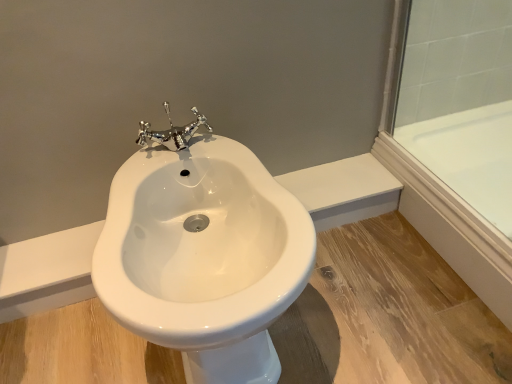
This screenshot has height=384, width=512. Describe the element at coordinates (455, 136) in the screenshot. I see `transparent glass door at upper right` at that location.

This screenshot has height=384, width=512. I want to click on transparent glass door at upper right, so click(x=455, y=136).

This screenshot has height=384, width=512. What do you see at coordinates (203, 253) in the screenshot?
I see `white glossy bidet at center` at bounding box center [203, 253].

Where is `white glossy bidet at center`? The height and width of the screenshot is (384, 512). white glossy bidet at center is located at coordinates (203, 253).

Locate an element on the screen. This screenshot has height=384, width=512. transparent glass door at upper right is located at coordinates (455, 136).

In the image, is white glossy bidet at center on the left side or the right side of transparent glass door at upper right?

white glossy bidet at center is to the left of transparent glass door at upper right.

Considering the positions of objects white glossy bidet at center and transparent glass door at upper right in the image provided, who is in front, white glossy bidet at center or transparent glass door at upper right?

white glossy bidet at center is more forward.

Considering the positions of points (212, 163) and (470, 189), is point (212, 163) farther from camera compared to point (470, 189)?

No, (212, 163) is closer to viewer.

From the image's perspective, is white glossy bidet at center located above or below transparent glass door at upper right?

Based on their image positions, white glossy bidet at center is located beneath transparent glass door at upper right.

From a real-world perspective, which object rests below the other?

transparent glass door at upper right is physically lower.

Considering the sizes of objects white glossy bidet at center and transparent glass door at upper right in the image provided, who is wider, white glossy bidet at center or transparent glass door at upper right?

white glossy bidet at center.

In the scene shown: Considering the sizes of objects white glossy bidet at center and transparent glass door at upper right in the image provided, who is taller, white glossy bidet at center or transparent glass door at upper right?

white glossy bidet at center is taller.

Considering the sizes of objects white glossy bidet at center and transparent glass door at upper right in the image provided, who is smaller, white glossy bidet at center or transparent glass door at upper right?

Smaller between the two is transparent glass door at upper right.

In the scene shown: Is white glossy bidet at center situated inside transparent glass door at upper right or outside?

white glossy bidet at center is not inside transparent glass door at upper right, it's outside.

Is white glossy bidet at center placed right next to transparent glass door at upper right?

No, white glossy bidet at center is not next to transparent glass door at upper right.

Is white glossy bidet at center facing away from transparent glass door at upper right?

white glossy bidet at center is not turned away from transparent glass door at upper right.

Locate an element on the screen. toilet located on the left of transparent glass door at upper right is located at coordinates (203, 253).

Is transparent glass door at upper right at the right side of white glossy bidet at center?

Correct, you'll find transparent glass door at upper right to the right of white glossy bidet at center.

Is transparent glass door at upper right in front of or behind white glossy bidet at center in the image?

Visually, transparent glass door at upper right is located behind white glossy bidet at center.

Which is closer to the camera, (x=473, y=128) or (x=184, y=194)?

The point (x=184, y=194) is closer to the camera.

From the image's perspective, is transparent glass door at upper right under white glossy bidet at center?

Actually, transparent glass door at upper right appears above white glossy bidet at center in the image.

From a real-world perspective, is transparent glass door at upper right under white glossy bidet at center?

Yes, from a real-world perspective, transparent glass door at upper right is beneath white glossy bidet at center.

Based on the photo, is transparent glass door at upper right thinner than white glossy bidet at center?

Yes, transparent glass door at upper right is thinner than white glossy bidet at center.

Considering the relative sizes of transparent glass door at upper right and white glossy bidet at center in the image provided, is transparent glass door at upper right taller than white glossy bidet at center?

No.

Is transparent glass door at upper right bigger or smaller than white glossy bidet at center?

Clearly, transparent glass door at upper right is smaller in size than white glossy bidet at center.

Is transparent glass door at upper right inside or outside of white glossy bidet at center?

transparent glass door at upper right exists outside the volume of white glossy bidet at center.

From the picture: Are transparent glass door at upper right and white glossy bidet at center located far from each other?

No, transparent glass door at upper right is not far away from white glossy bidet at center.

Is transparent glass door at upper right oriented away from white glossy bidet at center?

No, transparent glass door at upper right's orientation is not away from white glossy bidet at center.

Can you tell me how much transparent glass door at upper right and white glossy bidet at center differ in facing direction?

91.8 degrees.

At what (x,y) coordinates should I click in order to perform the action: click on toilet that is below the transparent glass door at upper right (from the image's perspective). Please return your answer as a coordinate pair (x, y). This screenshot has width=512, height=384. Looking at the image, I should click on (203, 253).

The width and height of the screenshot is (512, 384). In order to click on glass door located behind the white glossy bidet at center in this screenshot , I will do `click(455, 136)`.

Find the location of a particular element. toilet in front of the transparent glass door at upper right is located at coordinates coord(203,253).